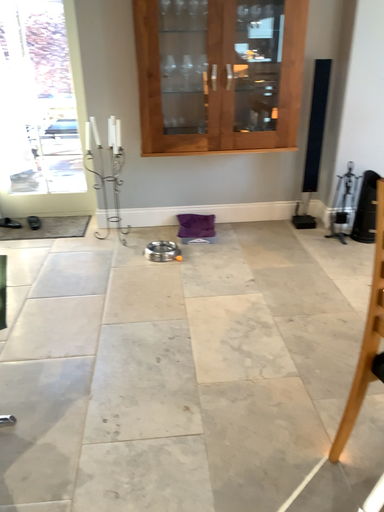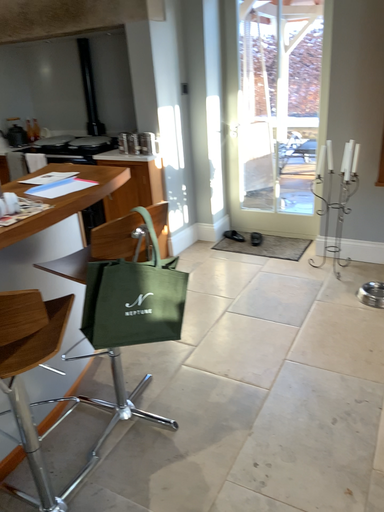
Question: How did the camera likely rotate when shooting the video?

Choices:
 (A) rotated left
 (B) rotated right

Answer: (A)